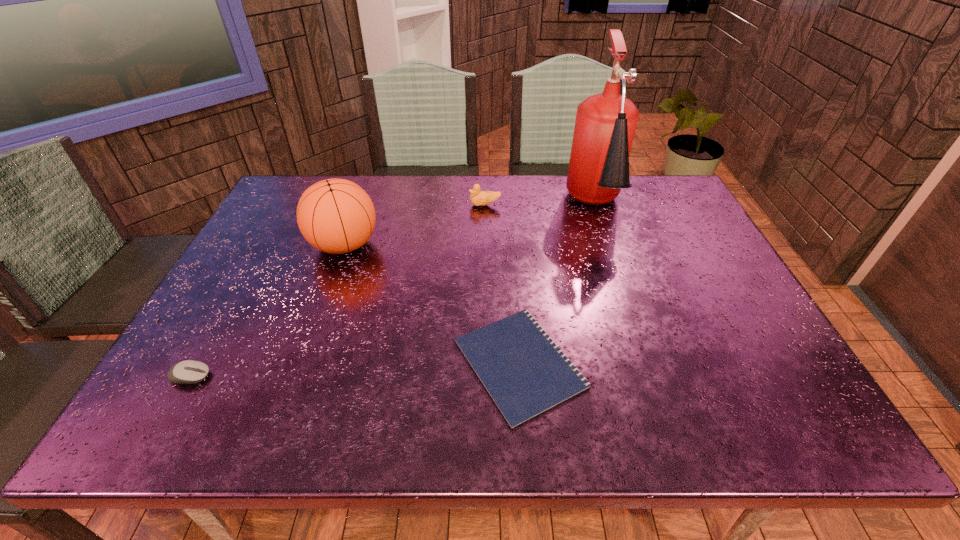
At what (x,y) coordinates should I click in order to perform the action: click on the rightmost object. Please return your answer as a coordinate pair (x, y). Looking at the image, I should click on (605, 125).

At what (x,y) coordinates should I click in order to perform the action: click on fire extinguisher. Please return your answer as a coordinate pair (x, y). The image size is (960, 540). Looking at the image, I should click on (605, 125).

Where is `the second object from left to right`? the second object from left to right is located at coordinates (336, 216).

The image size is (960, 540). In order to click on the fourth shortest object in this screenshot , I will do pos(336,216).

Locate an element on the screen. duckling is located at coordinates (479, 198).

Where is `the fourth tallest object`? The height and width of the screenshot is (540, 960). the fourth tallest object is located at coordinates (189, 371).

Locate an element on the screen. The height and width of the screenshot is (540, 960). the leftmost object is located at coordinates [x=189, y=371].

I want to click on the shortest object, so click(x=525, y=373).

Find the location of a particular element. The image size is (960, 540). free space located 0.330m with the nozzle aimed from the tallest object is located at coordinates (636, 328).

You are a GUI agent. You are given a task and a screenshot of the screen. Output one action in this format:
    pyautogui.click(x=<x>, y=<y>)
    Task: Click on the vacant point located on the right of the second object from left to right
    The width and height of the screenshot is (960, 540).
    Given the screenshot: What is the action you would take?
    pyautogui.click(x=468, y=245)